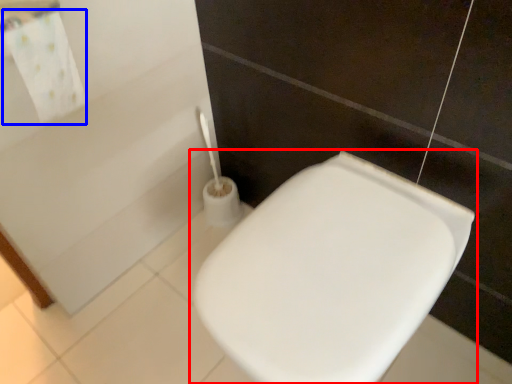
Question: Among these objects, which one is nearest to the camera, toilet (highlighted by a red box) or bath towel (highlighted by a blue box)?

Choices:
 (A) toilet
 (B) bath towel

Answer: (A)